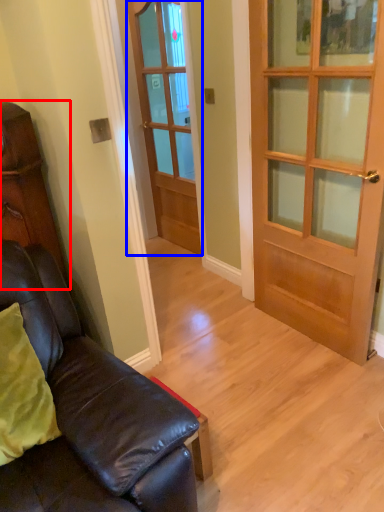
Question: Which of the following is the farthest to the observer, cabinetry (highlighted by a red box) or door (highlighted by a blue box)?

Choices:
 (A) cabinetry
 (B) door

Answer: (B)